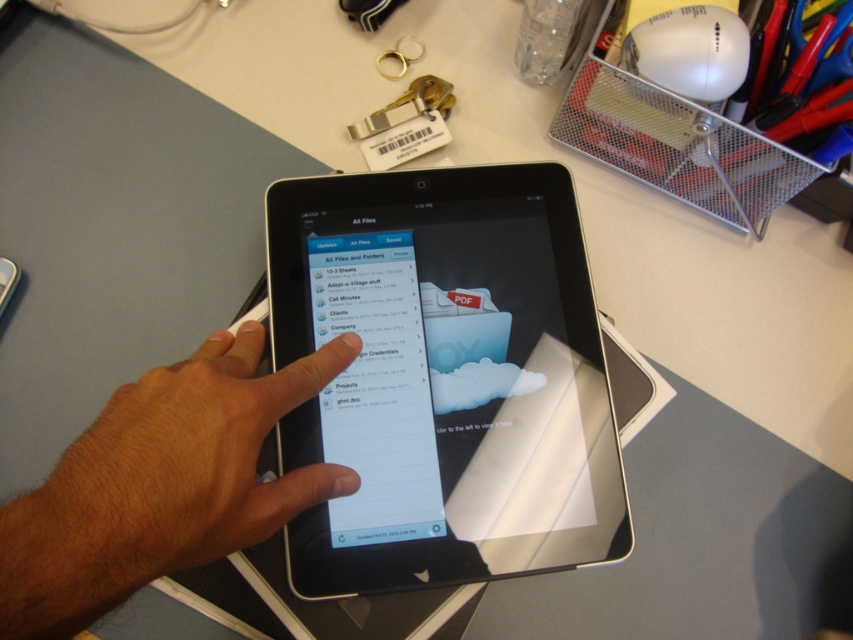
Does point (387, 573) come closer to viewer compared to point (148, 440)?

No, it is behind (148, 440).

Can you confirm if black glossy tablet at center is shorter than brown skin/hair at upper center?

No, black glossy tablet at center is not shorter than brown skin/hair at upper center.

Between point (276, 224) and point (143, 410), which one is positioned in front?

Point (143, 410) is more forward.

This screenshot has width=853, height=640. Identify the location of black glossy tablet at center. (444, 378).